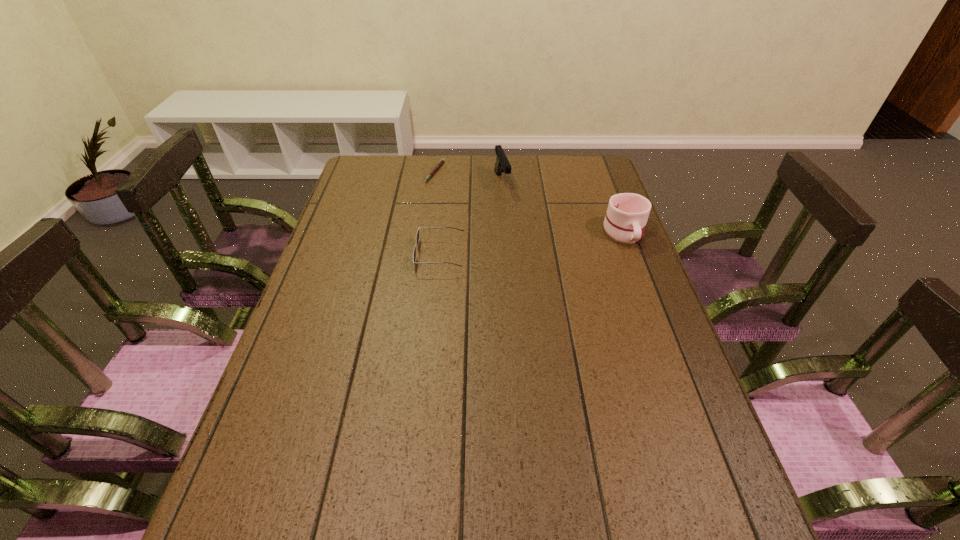
You are a GUI agent. You are given a task and a screenshot of the screen. Output one action in this format:
    pyautogui.click(x=<x>, y=<y>)
    Task: Click on the sunglasses
    This screenshot has height=540, width=960.
    Given the screenshot: What is the action you would take?
    pyautogui.click(x=417, y=235)

Identify the location of the rightmost object. Image resolution: width=960 pixels, height=540 pixels. (627, 213).

Identify the location of the third object from left to right. This screenshot has width=960, height=540. (502, 164).

At what (x,y) coordinates should I click in order to perform the action: click on the shortest object. Please return your answer as a coordinate pair (x, y). Image resolution: width=960 pixels, height=540 pixels. Looking at the image, I should click on (442, 160).

At what (x,y) coordinates should I click in order to perform the action: click on free region located 0.160m on the front-facing side of the second shortest object. Please return your answer as a coordinate pair (x, y). Looking at the image, I should click on (361, 255).

Locate an element on the screen. vacant point located on the front-facing side of the second shortest object is located at coordinates (375, 255).

I want to click on free space located 0.230m on the front-facing side of the second shortest object, so click(337, 255).

You are a GUI agent. You are given a task and a screenshot of the screen. Output one action in this format:
    pyautogui.click(x=<x>, y=<y>)
    Task: Click on the vacant position located on the side with the handle of the mug
    This screenshot has height=540, width=960.
    Given the screenshot: What is the action you would take?
    pyautogui.click(x=639, y=274)

The height and width of the screenshot is (540, 960). Find the location of `free space located 0.240m on the front-facing side of the second object from right to left`. free space located 0.240m on the front-facing side of the second object from right to left is located at coordinates (523, 237).

You are a GUI agent. You are given a task and a screenshot of the screen. Output one action in this format:
    pyautogui.click(x=<x>, y=<y>)
    Task: Click on the vacant space located 0.260m on the front-facing side of the second object from right to left
    This screenshot has height=540, width=960.
    Given the screenshot: What is the action you would take?
    pyautogui.click(x=525, y=241)